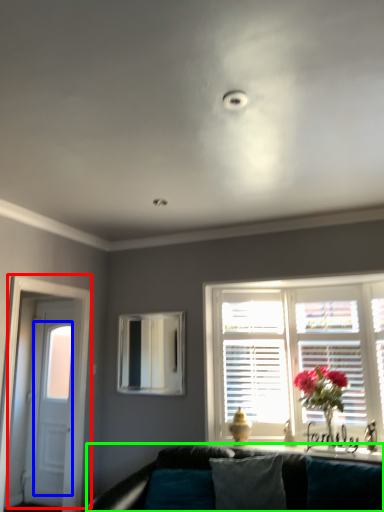
Question: Which is nearer to the door (highlighted by a red box)? glass door (highlighted by a blue box) or studio couch (highlighted by a green box).

Choices:
 (A) glass door
 (B) studio couch

Answer: (A)